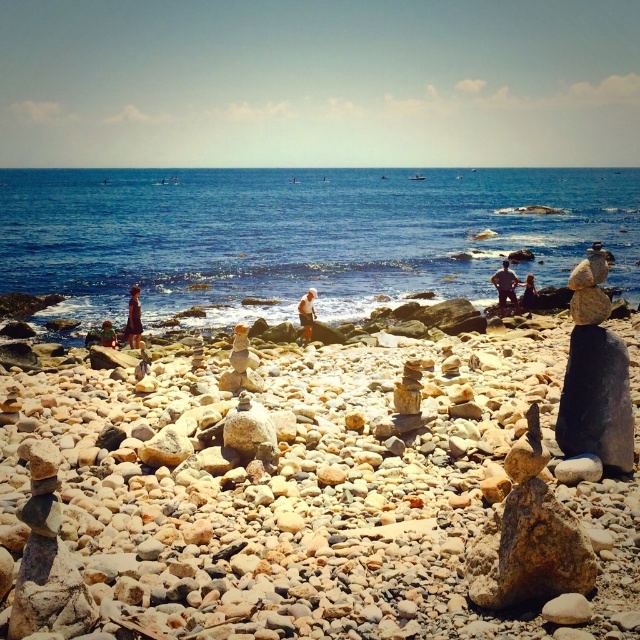
Is smooth sand at center taller than dark brown leather pants at center?

No.

Who is taller, smooth sand at center or dark brown leather pants at center?

dark brown leather pants at center

Locate an element on the screen. smooth sand at center is located at coordinates (241, 349).

Where is `smooth sand at center`? This screenshot has width=640, height=640. smooth sand at center is located at coordinates (241, 349).

Who is shorter, brown fabric dress at lower left or light brown wooden stick at center?

With less height is light brown wooden stick at center.

Locate an element on the screen. brown fabric dress at lower left is located at coordinates (132, 317).

Which is above, smooth sand at center or light brown hair at center?

smooth sand at center

Is smooth sand at center above light brown hair at center?

Yes.

This screenshot has width=640, height=640. Describe the element at coordinates (241, 349) in the screenshot. I see `smooth sand at center` at that location.

This screenshot has height=640, width=640. Identify the location of smooth sand at center. (241, 349).